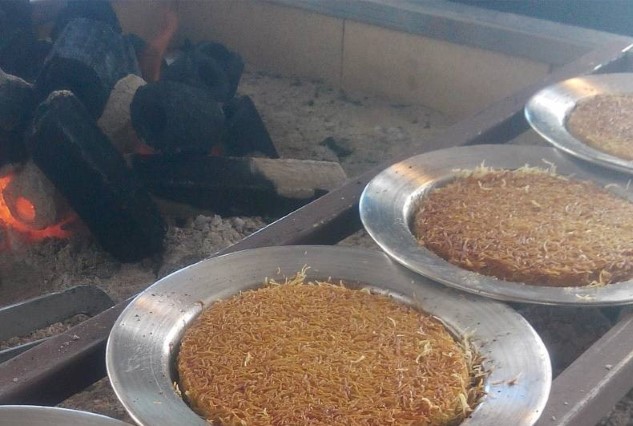
Locate an element on the screen. outer edge of fireplace is located at coordinates (456, 22).